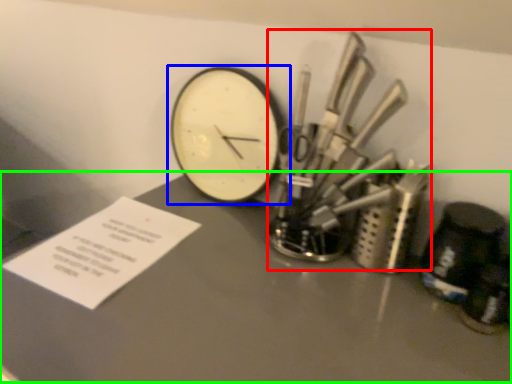
Question: Considering the real-world distances, which object is farthest from tool (highlighted by a red box)? wall clock (highlighted by a blue box) or table (highlighted by a green box)?

Choices:
 (A) wall clock
 (B) table

Answer: (A)